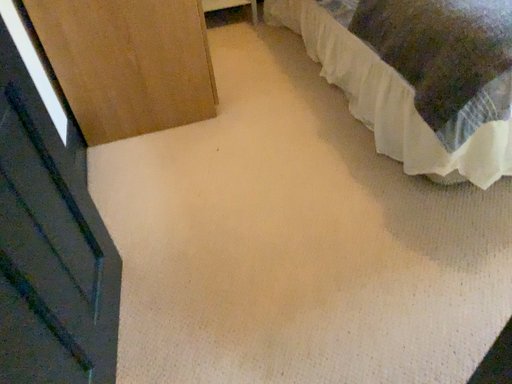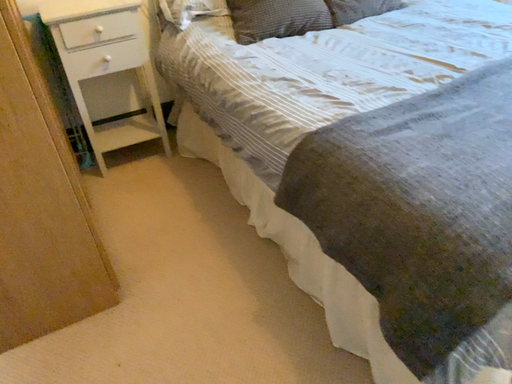
Question: How did the camera likely rotate when shooting the video?

Choices:
 (A) rotated right
 (B) rotated left

Answer: (A)